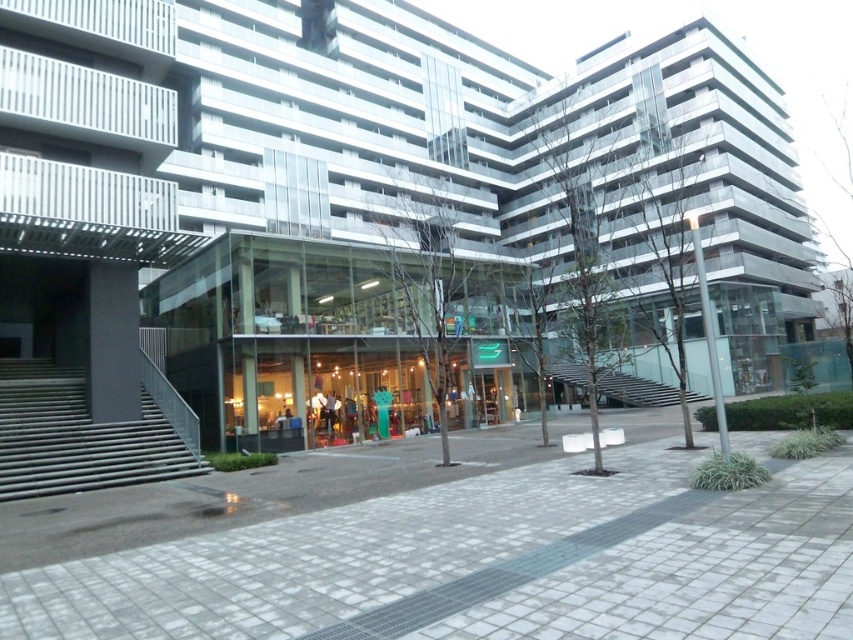
You are standing in front of the modern architectural complex. If you want to walk to the gray cobblestone pavement at center, which direction should you head towards?

The gray cobblestone pavement at center is located at point (486, 564) in the image, so you should head towards the center of the plaza to reach it.

You are standing at the entrance of the modern architectural complex and want to walk to the gray cobblestone pavement at center. According to the coordinates given, what are the exact coordinates where you should head towards?

The gray cobblestone pavement at center is located at coordinates point (486, 564), so you should head towards that exact point.

You are a visitor arriving at the plaza and want to enter the building through the main entrance. You see the metallic gray stairs at left and the glass transparent stairs at center. Which set of stairs is closer to the entrance?

The metallic gray stairs at left are closer to the entrance because the glass transparent stairs at center are positioned behind them.